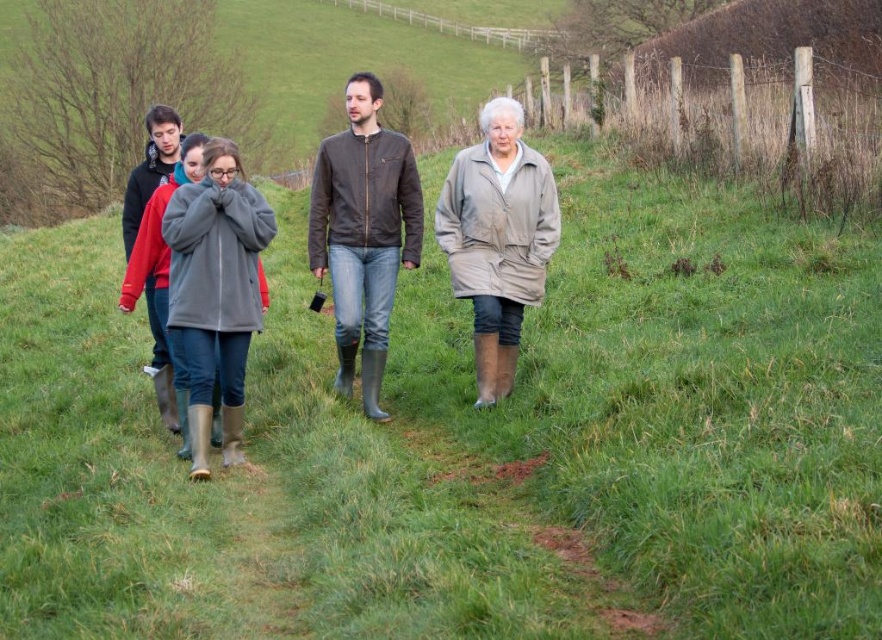
Is rubber boots at center bigger than beige leather coat at center?

Yes.

Is point (339, 148) positioned in front of point (467, 184)?

That is False.

Does point (339, 388) come in front of point (522, 186)?

No, it is behind (522, 186).

You are a GUI agent. You are given a task and a screenshot of the screen. Output one action in this format:
    pyautogui.click(x=<x>, y=<y>)
    Task: Click on the rubber boots at center
    The image size is (882, 640).
    Given the screenshot: What is the action you would take?
    pyautogui.click(x=363, y=232)

Is rubber boots at center to the right of gray fleece coat at center from the viewer's perspective?

Correct, you'll find rubber boots at center to the right of gray fleece coat at center.

Does point (311, 221) come farther from viewer compared to point (198, 401)?

Yes, it is.

The width and height of the screenshot is (882, 640). What are the coordinates of `rubber boots at center` in the screenshot? It's located at (363, 232).

Can you confirm if gray fleece coat at center is shorter than beige leather coat at center?

Incorrect, gray fleece coat at center's height does not fall short of beige leather coat at center's.

Is point (241, 253) closer to viewer compared to point (462, 192)?

Yes.

Where is `gray fleece coat at center`? gray fleece coat at center is located at coordinates (215, 292).